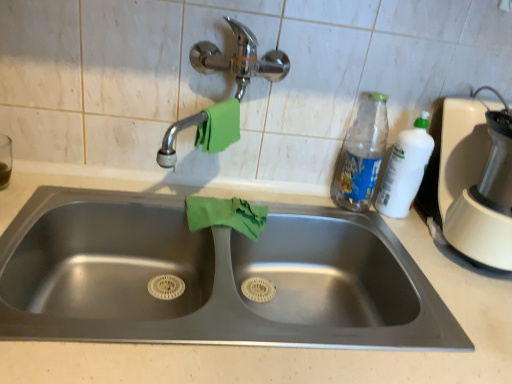
Question: From a real-world perspective, is translucent plastic bottle at upper right below white plastic blender at right?

Choices:
 (A) no
 (B) yes

Answer: (B)

Question: Is translucent plastic bottle at upper right in front of white plastic blender at right?

Choices:
 (A) no
 (B) yes

Answer: (A)

Question: From a real-world perspective, is translucent plastic bottle at upper right physically above white plastic blender at right?

Choices:
 (A) no
 (B) yes

Answer: (A)

Question: Is translucent plastic bottle at upper right at the right side of white plastic blender at right?

Choices:
 (A) no
 (B) yes

Answer: (A)

Question: Can you confirm if translucent plastic bottle at upper right is thinner than white plastic blender at right?

Choices:
 (A) no
 (B) yes

Answer: (B)

Question: Could you tell me if translucent plastic bottle at upper right is turned towards white plastic blender at right?

Choices:
 (A) no
 (B) yes

Answer: (A)

Question: From a real-world perspective, is white plastic blender at right on top of green fabric hand towel at upper center, positioned as the 1th hand towel in top-to-bottom order?

Choices:
 (A) no
 (B) yes

Answer: (A)

Question: Is white plastic blender at right completely or partially outside of green fabric hand towel at upper center, positioned as the second hand towel in bottom-to-top order?

Choices:
 (A) yes
 (B) no

Answer: (A)

Question: Is white plastic blender at right at the left side of green fabric hand towel at upper center, positioned as the 1th hand towel in top-to-bottom order?

Choices:
 (A) yes
 (B) no

Answer: (B)

Question: From the image's perspective, does white plastic blender at right appear lower than green fabric hand towel at upper center, positioned as the 1th hand towel in top-to-bottom order?

Choices:
 (A) yes
 (B) no

Answer: (A)

Question: Considering the relative sizes of white plastic blender at right and green fabric hand towel at upper center, positioned as the 1th hand towel in top-to-bottom order, in the image provided, is white plastic blender at right bigger than green fabric hand towel at upper center, positioned as the 1th hand towel in top-to-bottom order,?

Choices:
 (A) no
 (B) yes

Answer: (B)

Question: Can you confirm if white plastic blender at right is smaller than green fabric hand towel at upper center, positioned as the second hand towel in bottom-to-top order?

Choices:
 (A) no
 (B) yes

Answer: (A)

Question: Considering the relative positions of white plastic blender at right and stainless steel sink at center in the image provided, is white plastic blender at right to the right of stainless steel sink at center from the viewer's perspective?

Choices:
 (A) no
 (B) yes

Answer: (B)